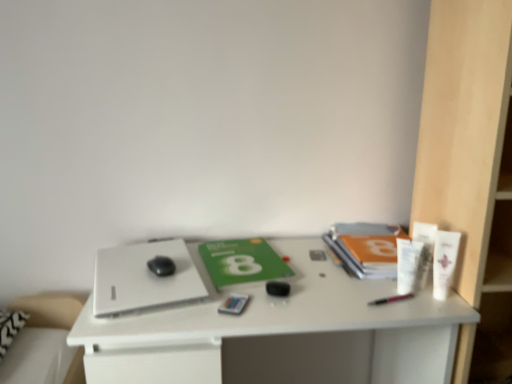
The height and width of the screenshot is (384, 512). I want to click on vacant area in front of orange matte book at right, the first paperback book when ordered from right to left, so click(x=372, y=296).